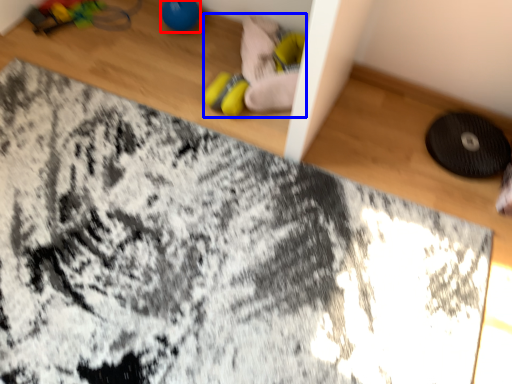
Question: Which object appears closest to the camera in this image, toy (highlighted by a red box) or toy (highlighted by a blue box)?

Choices:
 (A) toy
 (B) toy

Answer: (B)